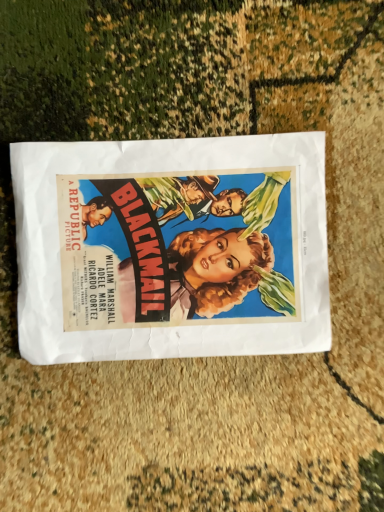
Describe the element at coordinates (171, 248) in the screenshot. I see `vibrant paper poster at center` at that location.

Locate an element on the screen. The image size is (384, 512). vibrant paper poster at center is located at coordinates (171, 248).

This screenshot has width=384, height=512. What are the coordinates of `vibrant paper poster at center` in the screenshot? It's located at (171, 248).